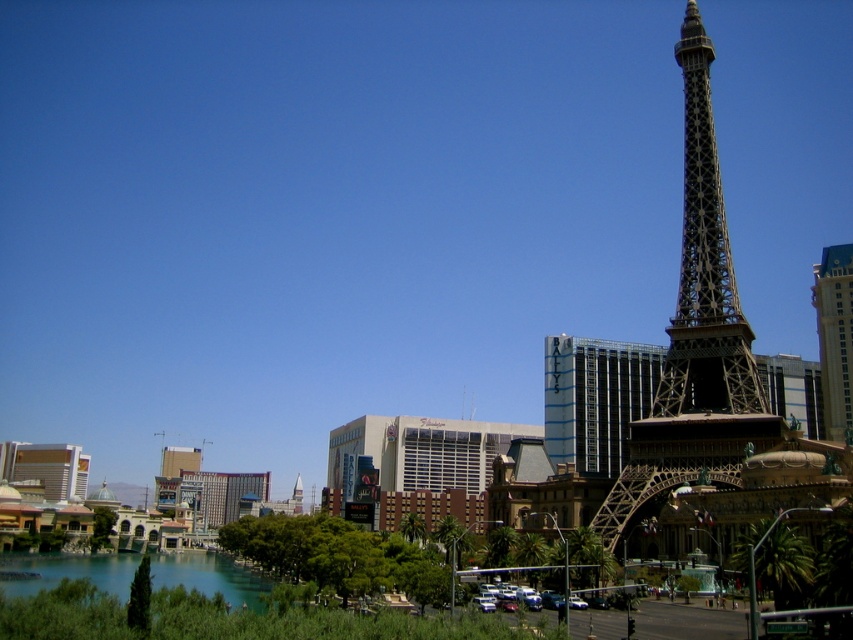
Who is higher up, metallic silver hotel at center or clear glass waterway at lower left?

Positioned higher is metallic silver hotel at center.

Can you confirm if metallic silver hotel at center is thinner than clear glass waterway at lower left?

Yes, metallic silver hotel at center is thinner than clear glass waterway at lower left.

Locate an element on the screen. metallic silver hotel at center is located at coordinates (595, 397).

Which is in front, point (202, 552) or point (849, 385)?

Point (849, 385) is in front.

Can you confirm if clear glass waterway at lower left is positioned below gold metallic hotel at right?

Yes, clear glass waterway at lower left is below gold metallic hotel at right.

Is point (28, 568) farther from camera compared to point (833, 369)?

No, it is in front of (833, 369).

Where is `clear glass waterway at lower left`? clear glass waterway at lower left is located at coordinates (67, 572).

Measure the distance between point (697, 316) and camera.

The distance of point (697, 316) from camera is 101.74 meters.

Is metallic brown eiffel tower at center smaller than clear glass waterway at lower left?

Indeed, metallic brown eiffel tower at center has a smaller size compared to clear glass waterway at lower left.

The width and height of the screenshot is (853, 640). What do you see at coordinates (704, 266) in the screenshot?
I see `metallic brown eiffel tower at center` at bounding box center [704, 266].

This screenshot has width=853, height=640. Identify the location of metallic brown eiffel tower at center. (704, 266).